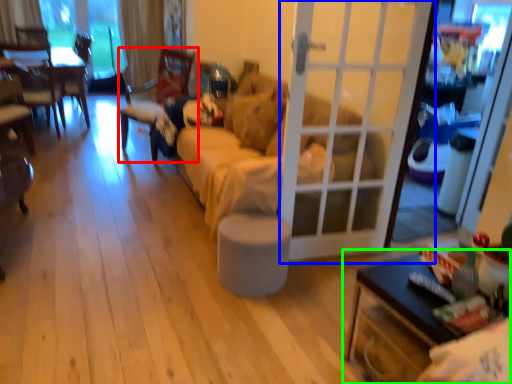
Question: Which is farther away from chair (highlighted by a red box)? door (highlighted by a blue box) or table (highlighted by a green box)?

Choices:
 (A) door
 (B) table

Answer: (B)